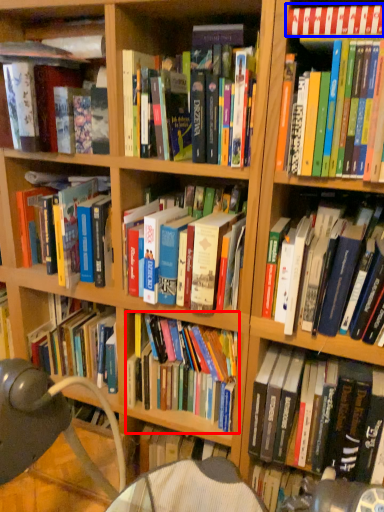
Question: Which object is further to the camera taking this photo, book (highlighted by a red box) or book (highlighted by a blue box)?

Choices:
 (A) book
 (B) book

Answer: (A)